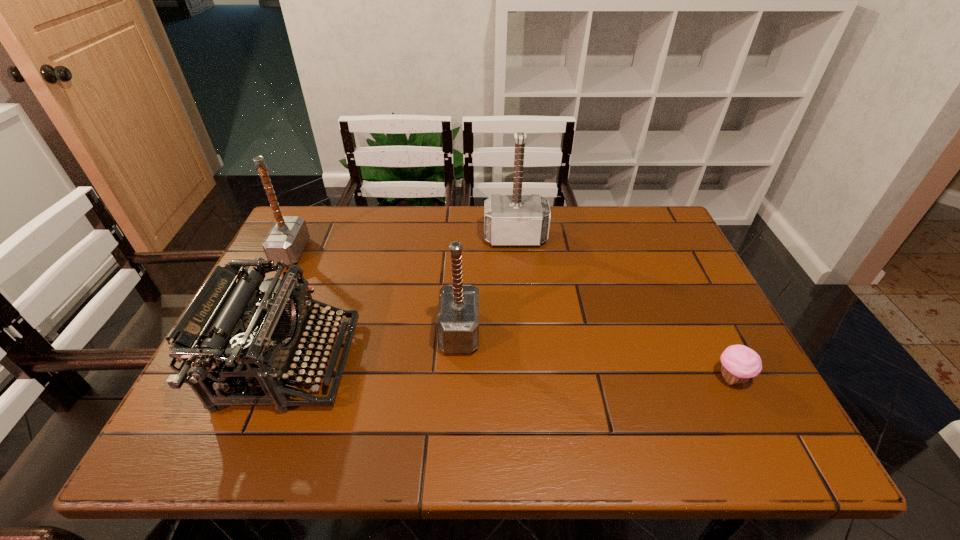
At what (x,y) coordinates should I click in order to perform the action: click on free location that satisfies the following two spatial constraints: 1. for striking with the head of the second object from right to left; 2. on the left side of the rightmost object. Please return your answer as a coordinate pair (x, y). Image resolution: width=960 pixels, height=540 pixels. Looking at the image, I should click on (529, 378).

This screenshot has height=540, width=960. I want to click on vacant space that satisfies the following two spatial constraints: 1. for striking with the head of the fourth object from left to right; 2. on the typing side of the second shortest object, so click(527, 362).